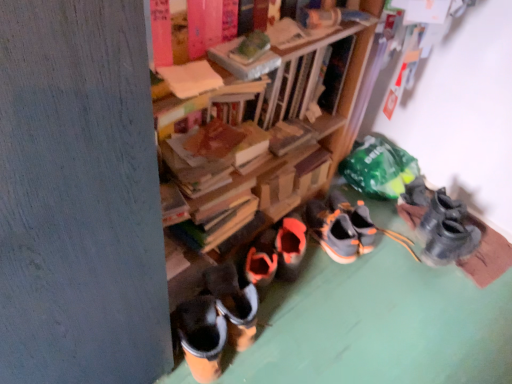
Question: Is there a large distance between gray suede sneakers at center, which is the 1th footwear from left to right, and wooden book at center, placed as the 2th book when sorted from front to back?

Choices:
 (A) no
 (B) yes

Answer: (A)

Question: Is gray suede sneakers at center, which is the 1th footwear from left to right, in contact with wooden book at center, placed as the 2th book when sorted from front to back?

Choices:
 (A) no
 (B) yes

Answer: (A)

Question: Is gray suede sneakers at center, which is counted as the 3th footwear, starting from the right, bigger than wooden book at center, placed as the 2th book when sorted from front to back?

Choices:
 (A) no
 (B) yes

Answer: (B)

Question: Is wooden book at center, placed as the 2th book when sorted from front to back, at the back of gray suede sneakers at center, which is counted as the 3th footwear, starting from the right?

Choices:
 (A) yes
 (B) no

Answer: (B)

Question: Considering the relative sizes of gray suede sneakers at center, which is the 1th footwear from left to right, and wooden book at center, placed as the 2th book when sorted from front to back, in the image provided, is gray suede sneakers at center, which is the 1th footwear from left to right, taller than wooden book at center, placed as the 2th book when sorted from front to back,?

Choices:
 (A) no
 (B) yes

Answer: (B)

Question: Is gray suede sneakers at center, which is counted as the 3th footwear, starting from the right, shorter than wooden book at center, marked as the first book in a back-to-front arrangement?

Choices:
 (A) yes
 (B) no

Answer: (B)

Question: From a real-world perspective, is orange suede sneakers at center, the second footwear positioned from the left, located beneath matte cardboard book at upper center, positioned as the first book in front-to-back order?

Choices:
 (A) yes
 (B) no

Answer: (A)

Question: Considering the relative positions of orange suede sneakers at center, positioned as the second footwear in right-to-left order, and matte cardboard book at upper center, positioned as the first book in front-to-back order, in the image provided, is orange suede sneakers at center, positioned as the second footwear in right-to-left order, to the right of matte cardboard book at upper center, positioned as the first book in front-to-back order, from the viewer's perspective?

Choices:
 (A) no
 (B) yes

Answer: (B)

Question: Considering the relative sizes of orange suede sneakers at center, the second footwear positioned from the left, and matte cardboard book at upper center, positioned as the first book in front-to-back order, in the image provided, is orange suede sneakers at center, the second footwear positioned from the left, taller than matte cardboard book at upper center, positioned as the first book in front-to-back order,?

Choices:
 (A) no
 (B) yes

Answer: (B)

Question: Does orange suede sneakers at center, positioned as the second footwear in right-to-left order, have a larger size compared to matte cardboard book at upper center, placed as the 2th book when sorted from back to front?

Choices:
 (A) no
 (B) yes

Answer: (B)

Question: Is orange suede sneakers at center, positioned as the second footwear in right-to-left order, thinner than matte cardboard book at upper center, positioned as the first book in front-to-back order?

Choices:
 (A) yes
 (B) no

Answer: (B)

Question: Is orange suede sneakers at center, the second footwear positioned from the left, touching matte cardboard book at upper center, placed as the 2th book when sorted from back to front?

Choices:
 (A) yes
 (B) no

Answer: (B)

Question: Can you confirm if gray suede sneakers at center, which is the 1th footwear from left to right, is shorter than orange suede sneakers at center, the second footwear positioned from the left?

Choices:
 (A) yes
 (B) no

Answer: (B)